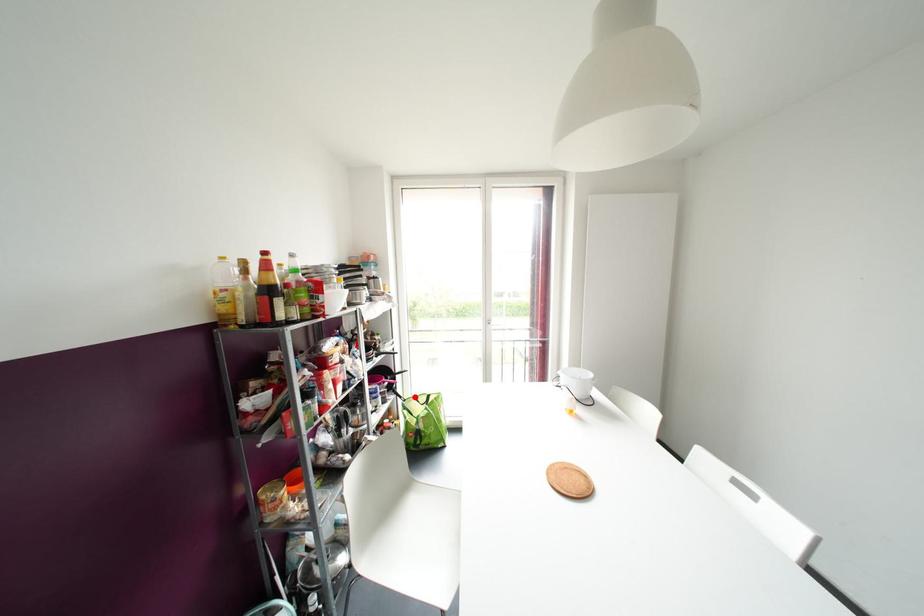
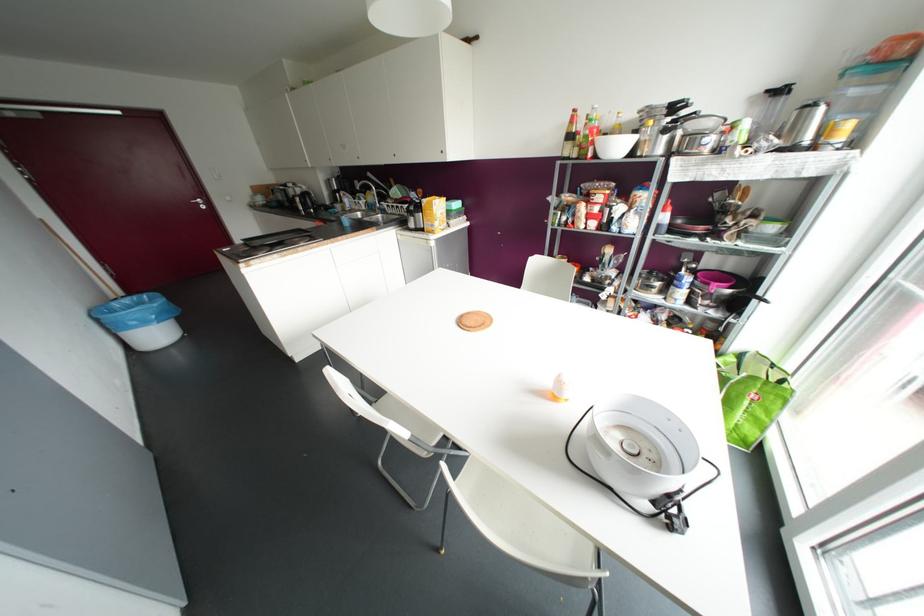
Question: I am providing you with two images of the same scene from different viewpoints. In image1, a red point is highlighted. Considering the same 3D point in image2, which of the following is correct?

Choices:
 (A) It is closer
 (B) It is farther

Answer: (A)